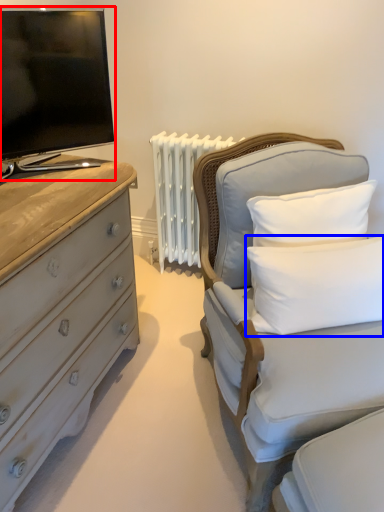
Question: Which object appears closest to the camera in this image, television (highlighted by a red box) or pillow (highlighted by a blue box)?

Choices:
 (A) television
 (B) pillow

Answer: (A)